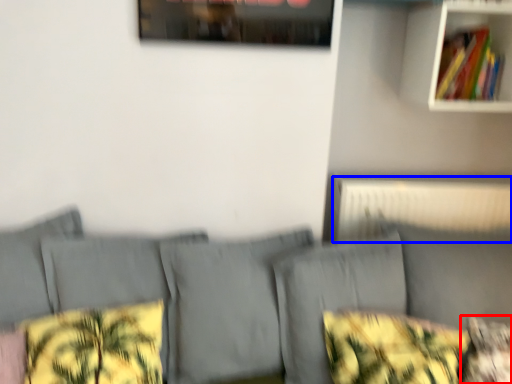
Question: Which point is further to the camera, pillow (highlighted by a red box) or radiator (highlighted by a blue box)?

Choices:
 (A) pillow
 (B) radiator

Answer: (B)